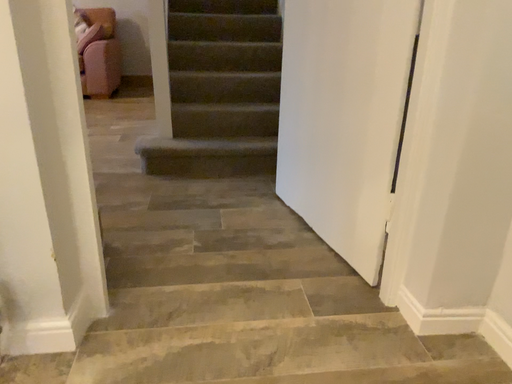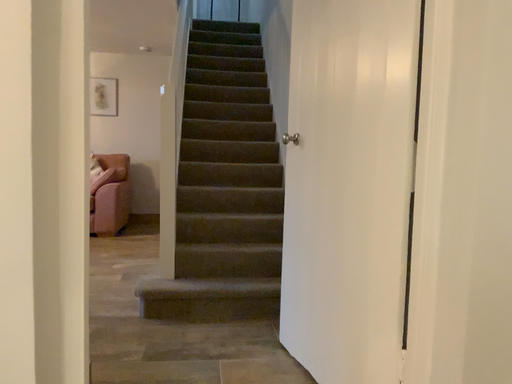
Question: How did the camera likely rotate when shooting the video?

Choices:
 (A) rotated upward
 (B) rotated downward

Answer: (A)